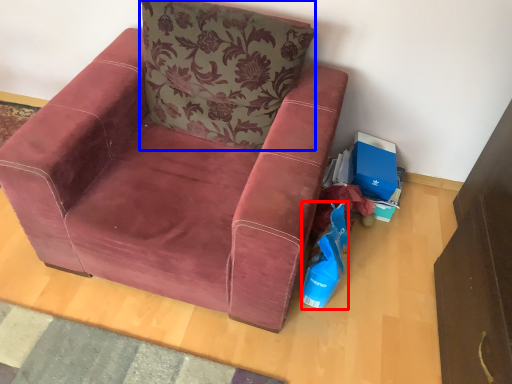
Question: Among these objects, which one is farthest to the camera, shopping bag (highlighted by a red box) or pillow (highlighted by a blue box)?

Choices:
 (A) shopping bag
 (B) pillow

Answer: (A)